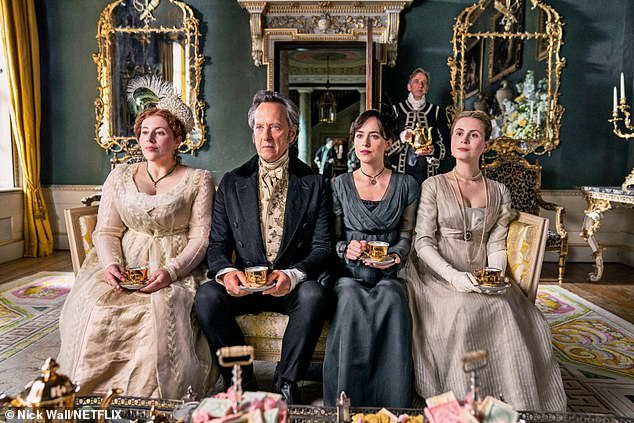
Where is `chair`? This screenshot has height=423, width=634. chair is located at coordinates (522, 190).